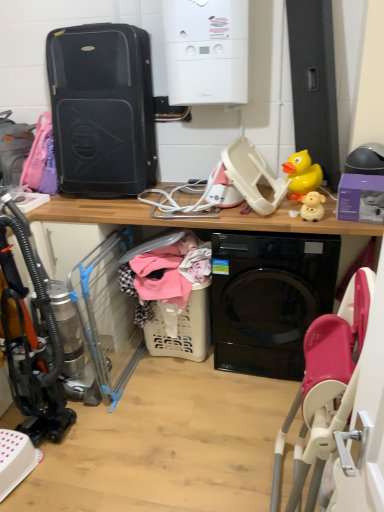
I want to click on free spot to the right of white matte sheep at upper right, which is the 1th toy from front to back, so click(x=350, y=218).